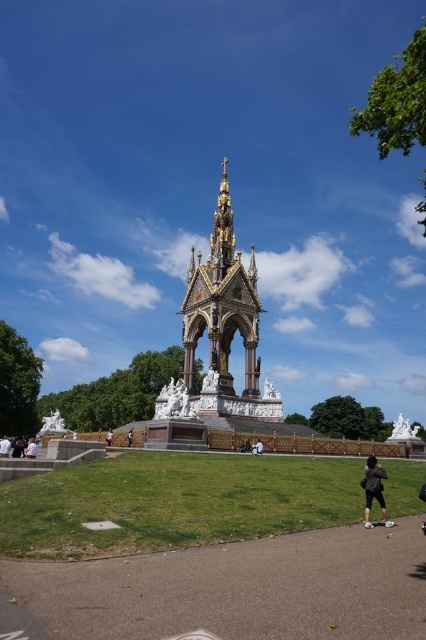
Is gold/gilded stone monument at center further to camera compared to white marble statue at center?

No, it is in front of white marble statue at center.

At what (x,y) coordinates should I click in order to perform the action: click on gold/gilded stone monument at center. Please return your answer as a coordinate pair (x, y). Image resolution: width=426 pixels, height=640 pixels. Looking at the image, I should click on (224, 323).

Find the location of a particular element. gold/gilded stone monument at center is located at coordinates (224, 323).

Can you confirm if black fabric person at lower left is positioned above pink fabric dress at center?

No, black fabric person at lower left is not above pink fabric dress at center.

Locate an element on the screen. This screenshot has height=640, width=426. black fabric person at lower left is located at coordinates (17, 449).

Is point (417, 486) positioned before point (405, 440)?

Yes, it is.

In order to click on green grass at center in this screenshot , I will do `click(175, 500)`.